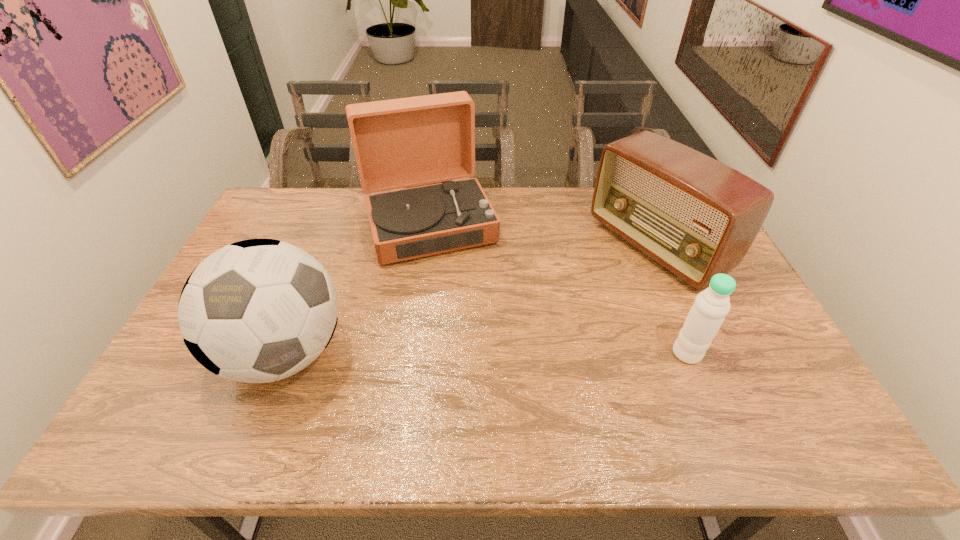
The width and height of the screenshot is (960, 540). In order to click on vacant point located on the face of the phonograph record in this screenshot , I will do `click(483, 367)`.

Where is `radio receiver that is at the far edge`? radio receiver that is at the far edge is located at coordinates (697, 217).

I want to click on phonograph record positioned at the far edge, so click(x=398, y=143).

You are a GUI agent. You are given a task and a screenshot of the screen. Output one action in this format:
    pyautogui.click(x=<x>, y=<y>)
    Task: Click on the object that is at the near edge
    
    Given the screenshot: What is the action you would take?
    pyautogui.click(x=259, y=310)

Image resolution: width=960 pixels, height=540 pixels. I want to click on object at the left edge, so click(259, 310).

This screenshot has width=960, height=540. In order to click on object that is at the right edge in this screenshot , I will do `click(697, 217)`.

This screenshot has height=540, width=960. Find the location of `object located at the near left corner`. object located at the near left corner is located at coordinates (259, 310).

You are a GUI agent. You are given a task and a screenshot of the screen. Output one action in this format:
    pyautogui.click(x=<x>, y=<y>)
    Task: Click on the object that is at the far right corner
    
    Given the screenshot: What is the action you would take?
    pyautogui.click(x=697, y=217)

Find the location of a particular element. vacant region at the far edge of the desktop is located at coordinates click(x=499, y=213).

Where is `free region at the near edge of the desktop`? Image resolution: width=960 pixels, height=540 pixels. free region at the near edge of the desktop is located at coordinates (694, 387).